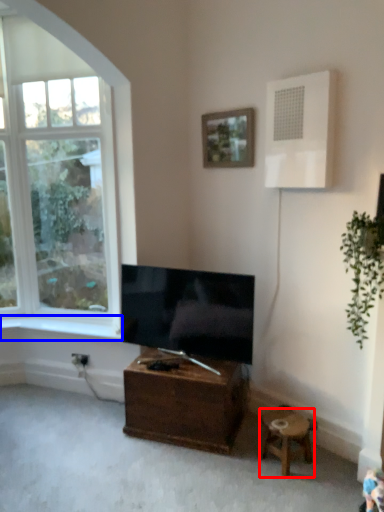
Question: Which object is closer to the camera taking this photo, stool (highlighted by a red box) or window sill (highlighted by a blue box)?

Choices:
 (A) stool
 (B) window sill

Answer: (A)